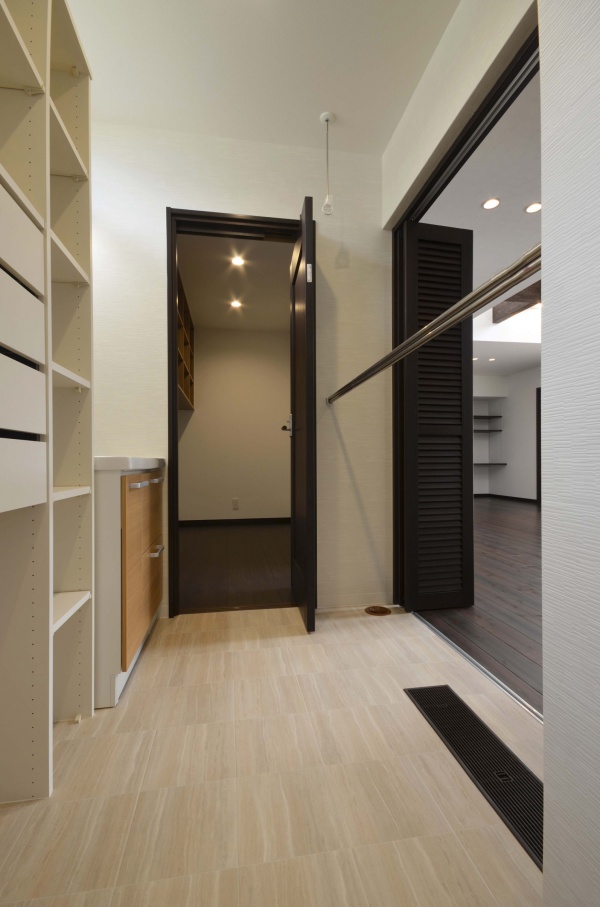
Locate an element on the screen. accordian door is located at coordinates (464, 460).